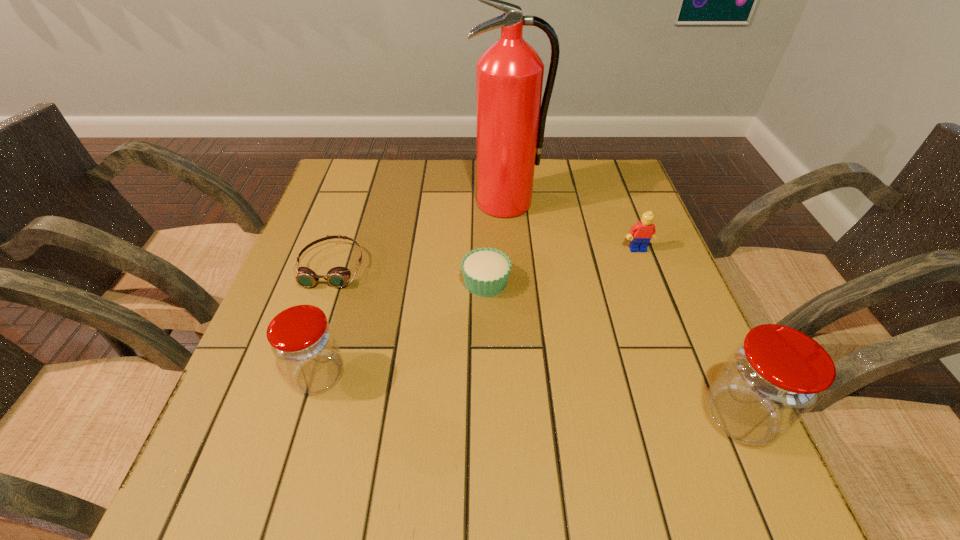
The height and width of the screenshot is (540, 960). Find the location of `empty space between the shortest object and the farthest object`. empty space between the shortest object and the farthest object is located at coordinates (420, 234).

The width and height of the screenshot is (960, 540). Identify the location of vacant area that lies between the cupcake and the fourth shortest object. (402, 328).

Image resolution: width=960 pixels, height=540 pixels. What are the coordinates of `empty space between the fifth tallest object and the third tallest object` in the screenshot? It's located at (402, 328).

Image resolution: width=960 pixels, height=540 pixels. Identify the location of vacant space that is in between the farthest object and the taller jar. (623, 309).

At what (x,y) coordinates should I click in order to perform the action: click on vacant space that's between the shorter jar and the fire extinguisher. Please return your answer as a coordinate pair (x, y). This screenshot has height=540, width=960. Looking at the image, I should click on (413, 289).

The height and width of the screenshot is (540, 960). I want to click on vacant point located between the left jar and the taller jar, so click(529, 396).

Find the location of a particular element. The height and width of the screenshot is (540, 960). object that is the fifth closest one to the second shortest object is located at coordinates (772, 379).

Find the location of a particular element. the fourth closest object to the second tallest object is located at coordinates point(302,340).

This screenshot has width=960, height=540. In order to click on free point that satisfies the following two spatial constraints: 1. through the lenses of the second tallest object; 2. on the left side of the goggles in this screenshot , I will do `click(280, 417)`.

Image resolution: width=960 pixels, height=540 pixels. I want to click on free space that satisfies the following two spatial constraints: 1. through the lenses of the shortest object; 2. on the left side of the cupcake, so click(326, 282).